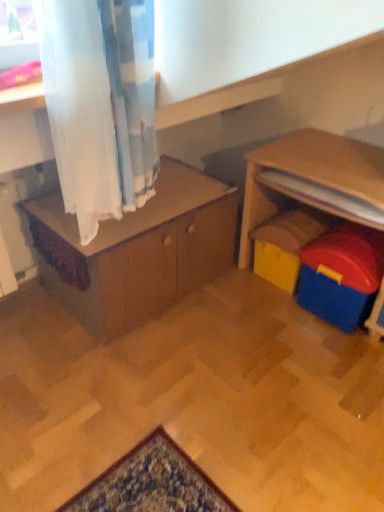
Question: Relative to yellow plastic toy at lower right, which appears as the 1th toy when viewed from the back, is wooden cabinet at center in front or behind?

Choices:
 (A) front
 (B) behind

Answer: (A)

Question: From the image's perspective, is wooden cabinet at center above or below yellow plastic toy at lower right, the second toy in the front-to-back sequence?

Choices:
 (A) above
 (B) below

Answer: (A)

Question: Which object is the farthest from the blue plastic toy at right, which ranks as the 1th toy in front-to-back order?

Choices:
 (A) yellow plastic toy at lower right, which appears as the 1th toy when viewed from the back
 (B) wooden cabinet at center

Answer: (B)

Question: Which of these objects is positioned closest to the blue plastic toy at right, which ranks as the 1th toy in front-to-back order?

Choices:
 (A) wooden cabinet at center
 (B) yellow plastic toy at lower right, the second toy in the front-to-back sequence

Answer: (B)